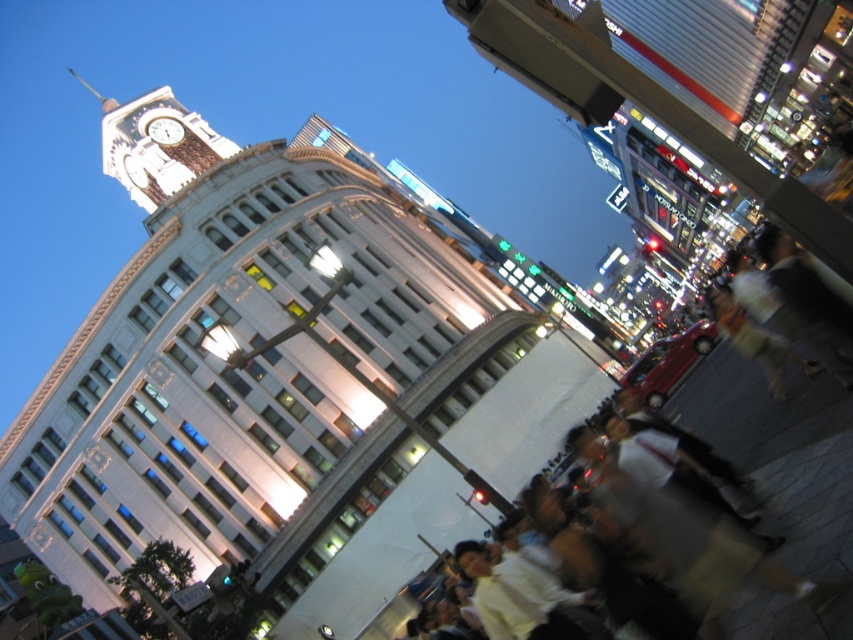
Looking at this image, can you confirm if light beige shirt at lower right is positioned to the left of white stone clock tower at upper left?

In fact, light beige shirt at lower right is to the right of white stone clock tower at upper left.

Is light beige shirt at lower right bigger than white stone clock tower at upper left?

No.

Who is more distant from viewer, (782, 532) or (138, 161)?

Point (138, 161)

Locate an element on the screen. This screenshot has width=853, height=640. light beige shirt at lower right is located at coordinates (788, 465).

Does point (103, 129) lie behind point (161, 122)?

Yes.

Does white stone clock tower at upper left have a lesser height compared to matte white clock at upper left?

Incorrect, white stone clock tower at upper left's height does not fall short of matte white clock at upper left's.

Consider the image. Who is more distant from viewer, (102, 164) or (167, 134)?

Answer: The point (102, 164) is more distant.

This screenshot has height=640, width=853. I want to click on white stone clock tower at upper left, so click(x=154, y=145).

Is light beige shirt at lower right below matte white clock at upper left?

Yes.

Is light beige shirt at lower right smaller than matte white clock at upper left?

Incorrect, light beige shirt at lower right is not smaller in size than matte white clock at upper left.

Looking at this image, who is more forward, (737, 452) or (177, 141)?

Point (737, 452) is in front.

Image resolution: width=853 pixels, height=640 pixels. I want to click on light beige shirt at lower right, so click(788, 465).